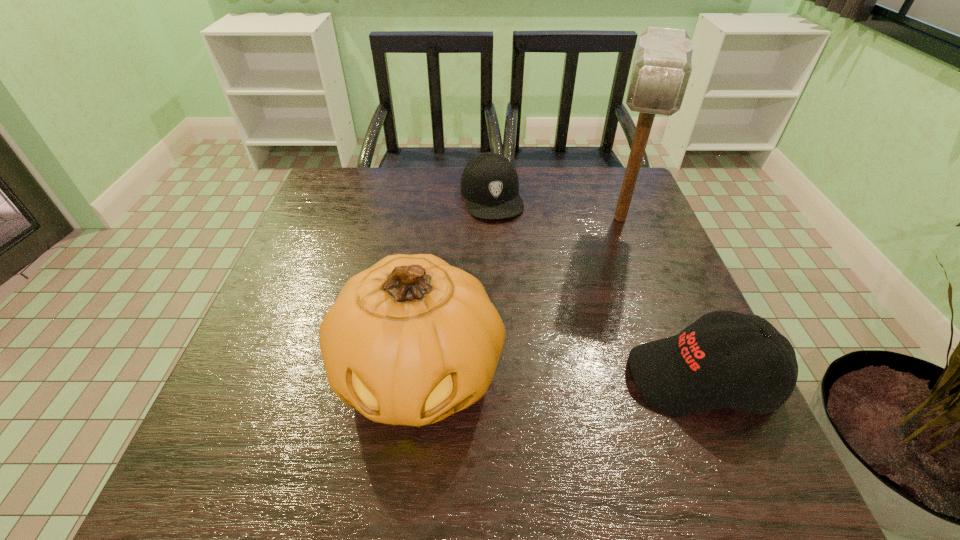
Identify the location of object situated at the near right corner. (688, 373).

Find the location of a particular element. This screenshot has height=540, width=960. blank space at the far edge is located at coordinates (403, 168).

You are a GUI agent. You are given a task and a screenshot of the screen. Output one action in this format:
    pyautogui.click(x=<x>, y=<y>)
    Task: Click on the vacant area at the near edge
    This screenshot has width=960, height=540.
    Given the screenshot: What is the action you would take?
    pyautogui.click(x=401, y=427)

In the image, there is a desktop. Identify the location of vacant space at the left edge. (251, 341).

You are a GUI agent. You are given a task and a screenshot of the screen. Output one action in this format:
    pyautogui.click(x=<x>, y=<y>)
    Task: Click on the free space at the right edge of the desktop
    The width and height of the screenshot is (960, 540).
    Given the screenshot: What is the action you would take?
    pyautogui.click(x=630, y=271)

This screenshot has height=540, width=960. In the image, there is a desktop. What are the coordinates of `blank space at the near left corner` in the screenshot? It's located at pos(241,414).

You are a GUI agent. You are given a task and a screenshot of the screen. Output one action in this format:
    pyautogui.click(x=<x>, y=<y>)
    Task: Click on the vacant space at the far right corner of the desktop
    
    Given the screenshot: What is the action you would take?
    [630, 213]

Identify the location of unoccupied area between the tallest object and the cap. The image size is (960, 540). (556, 207).

Locate an element on the screen. The height and width of the screenshot is (540, 960). free spot between the third tallest object and the second tallest object is located at coordinates (561, 376).

Identify the location of free area in between the second shortest object and the pumpkin. The image size is (960, 540). (561, 376).